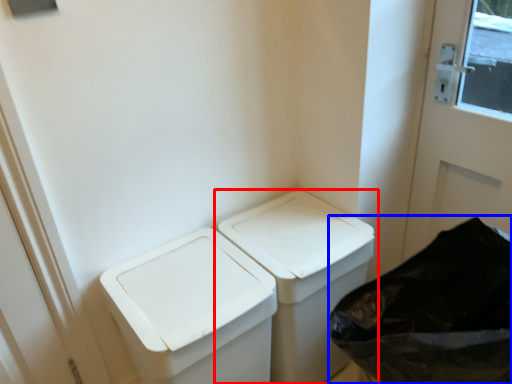
Question: Which object is further to the camera taking this photo, waste container (highlighted by a red box) or recycling bin (highlighted by a blue box)?

Choices:
 (A) waste container
 (B) recycling bin

Answer: (A)